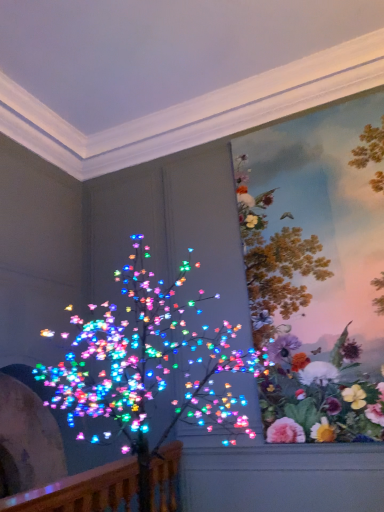
Question: Is point (165, 490) positioned closer to the camera than point (311, 404)?

Choices:
 (A) farther
 (B) closer

Answer: (A)

Question: From the image's perspective, is wooden at left positioned above or below floral wallpaper at upper right?

Choices:
 (A) below
 (B) above

Answer: (A)

Question: Estimate the real-world distances between objects in this image. Which object is closer to the floral wallpaper at upper right?

Choices:
 (A) multicolored lights at left
 (B) wooden at left

Answer: (A)

Question: Which object is positioned farthest from the multicolored lights at left?

Choices:
 (A) wooden at left
 (B) floral wallpaper at upper right

Answer: (A)